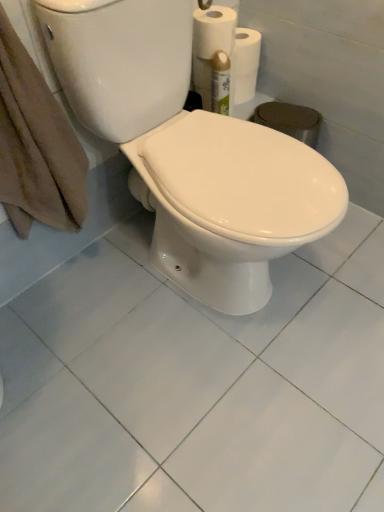
Locate an element on the screen. This screenshot has width=384, height=512. free space on the front side of white glossy toilet at center is located at coordinates (205, 411).